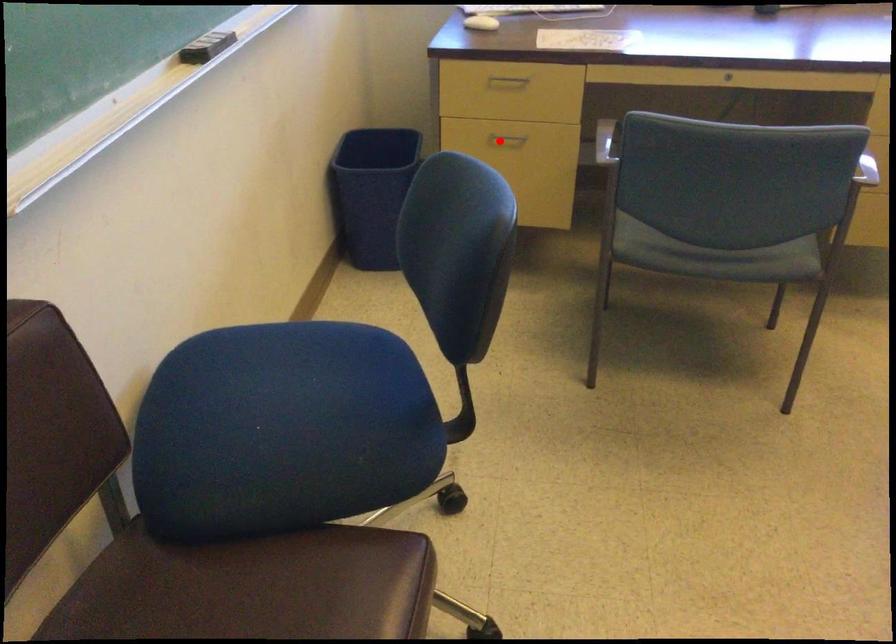
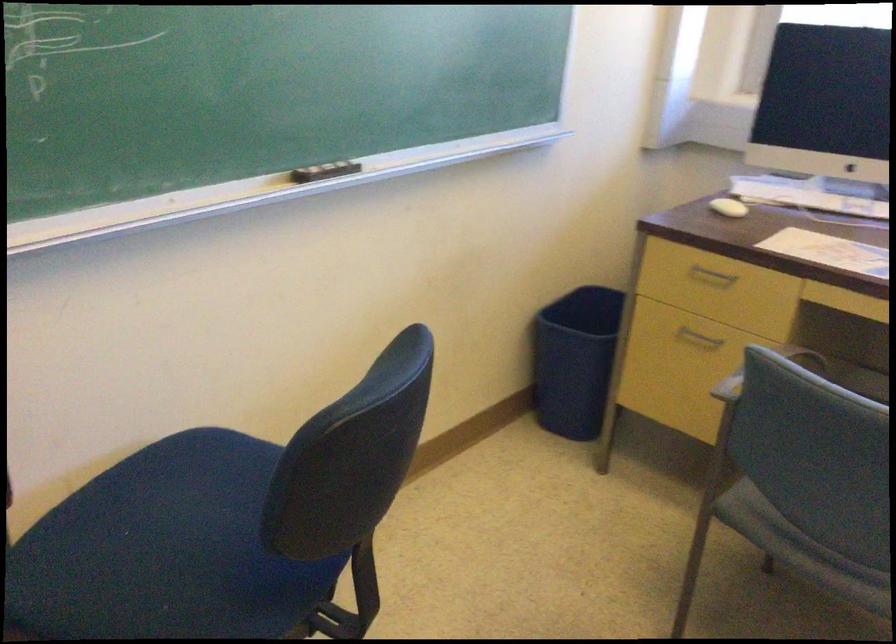
Locate, in the second image, the point that corresponds to the highlighted location in the first image.

(698, 337)